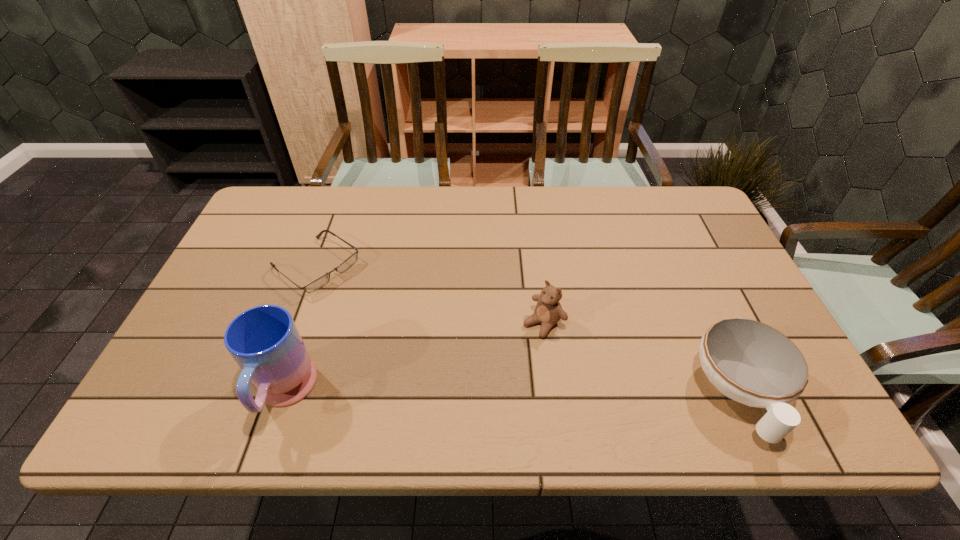
Locate an element on the screen. The image size is (960, 540). free space located on the front-facing side of the second object from right to left is located at coordinates (476, 386).

This screenshot has height=540, width=960. Identify the location of mug that is at the near edge. (264, 341).

This screenshot has width=960, height=540. I want to click on chinaware that is at the near edge, so click(x=752, y=363).

Where is `object at the left edge`? object at the left edge is located at coordinates (323, 280).

Locate an element on the screen. object at the right edge is located at coordinates (752, 363).

Where is `object positioned at the near right corner`? object positioned at the near right corner is located at coordinates (752, 363).

Where is `vacant region at the far edge of the desktop`? vacant region at the far edge of the desktop is located at coordinates (632, 219).

You are a GUI agent. You are given a task and a screenshot of the screen. Output one action in this format:
    pyautogui.click(x=<x>, y=<y>)
    Task: Click on the vacant space at the near edge of the desktop
    
    Given the screenshot: What is the action you would take?
    pyautogui.click(x=447, y=376)

Where is `free location at the left edge of the desktop`? The image size is (960, 540). free location at the left edge of the desktop is located at coordinates (240, 282).

Where is `blank space at the right edge of the desktop`? The width and height of the screenshot is (960, 540). blank space at the right edge of the desktop is located at coordinates (699, 303).